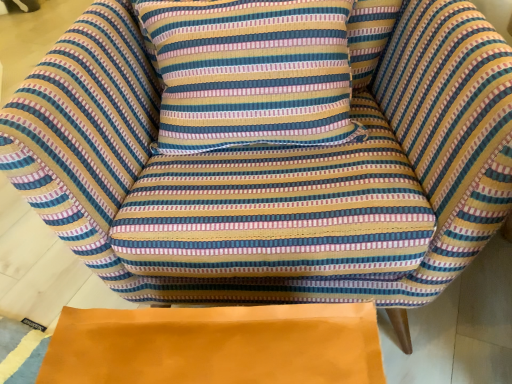
Describe the element at coordinates (250, 72) in the screenshot. I see `striped fabric pillow at center` at that location.

The height and width of the screenshot is (384, 512). Find the location of `striped fabric pillow at center`. striped fabric pillow at center is located at coordinates (250, 72).

You are a GUI agent. You are given a task and a screenshot of the screen. Output one action in this format:
    pyautogui.click(x=<x>, y=<y>)
    Task: Click on the striped fabric pillow at center
    The height and width of the screenshot is (384, 512).
    Given the screenshot: What is the action you would take?
    pyautogui.click(x=250, y=72)